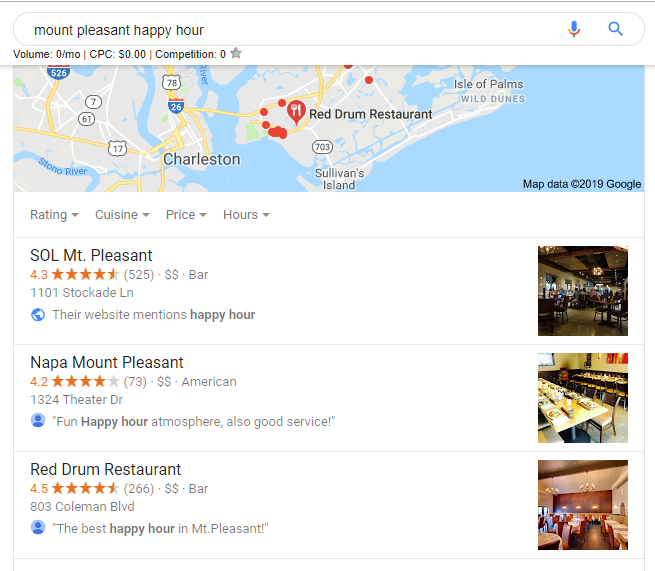
Locate an element on the screen. The height and width of the screenshot is (571, 655). table is located at coordinates (576, 417).